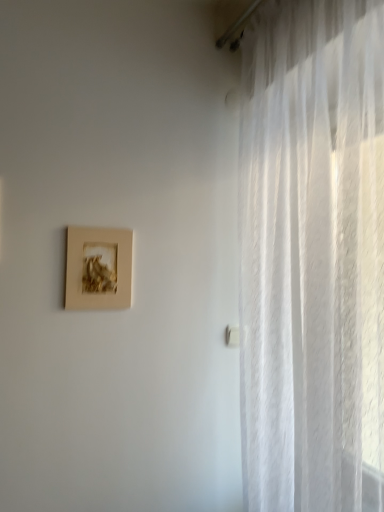
Question: Considering the positions of white sheer curtain at right and matte gold picture frame at upper left in the image, is white sheer curtain at right taller or shorter than matte gold picture frame at upper left?

Choices:
 (A) tall
 (B) short

Answer: (A)

Question: Choose the correct answer: Is white sheer curtain at right inside matte gold picture frame at upper left or outside it?

Choices:
 (A) inside
 (B) outside

Answer: (B)

Question: From the image's perspective, is white sheer curtain at right above or below matte gold picture frame at upper left?

Choices:
 (A) below
 (B) above

Answer: (A)

Question: Considering their positions, is matte gold picture frame at upper left located in front of or behind white sheer curtain at right?

Choices:
 (A) behind
 (B) front

Answer: (A)

Question: From a real-world perspective, relative to white sheer curtain at right, is matte gold picture frame at upper left vertically above or below?

Choices:
 (A) below
 (B) above

Answer: (B)

Question: In the image, is matte gold picture frame at upper left on the left side or the right side of white sheer curtain at right?

Choices:
 (A) right
 (B) left

Answer: (B)

Question: Which is correct: matte gold picture frame at upper left is inside white sheer curtain at right, or outside of it?

Choices:
 (A) inside
 (B) outside

Answer: (B)